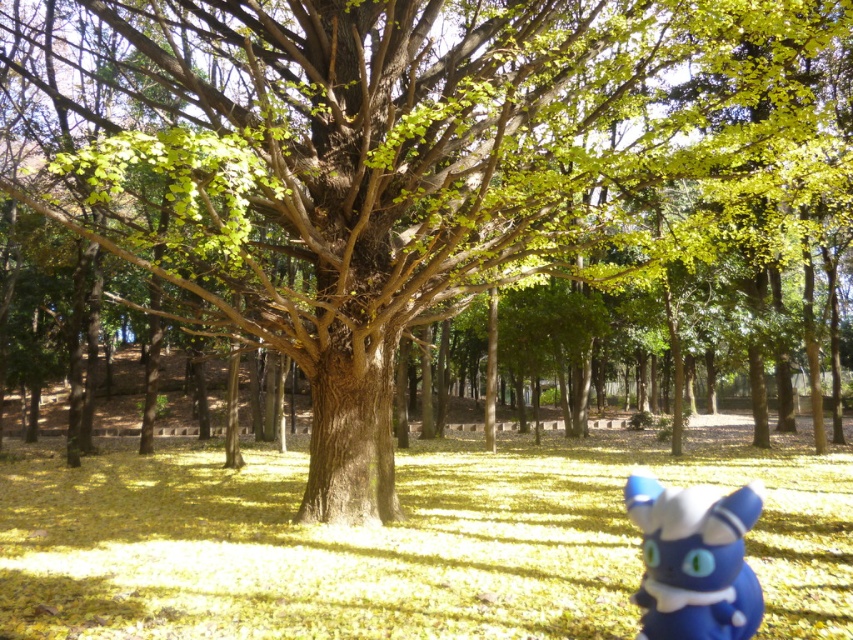
Is point (799, 456) behind point (688, 502)?

Yes.

Is yellow matte grass at center thinner than blue matte plush toy at lower right?

No, yellow matte grass at center is not thinner than blue matte plush toy at lower right.

What are the coordinates of `yellow matte grass at center` in the screenshot? It's located at (398, 540).